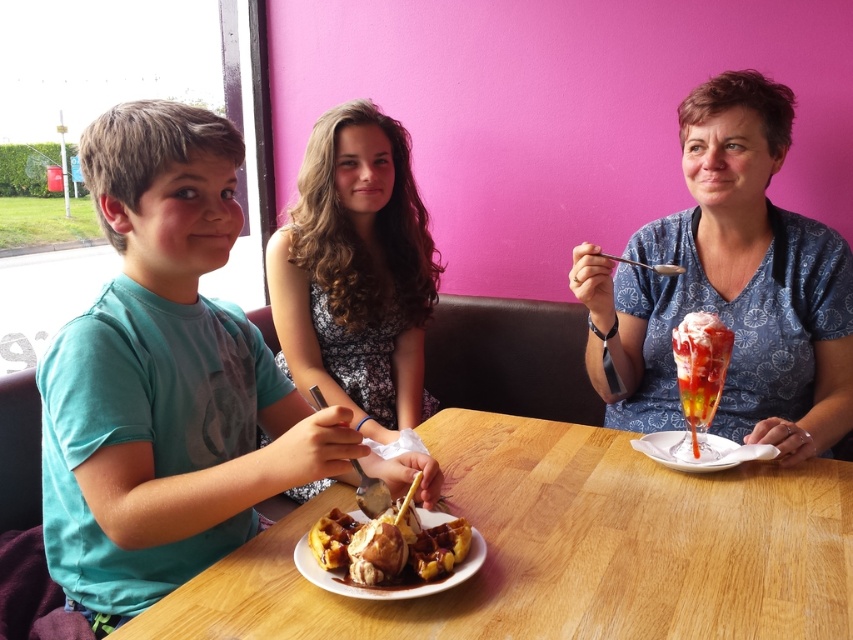
You are a photographer taking a picture of the dining scene. You notice two points in the image at coordinates point (140, 465) and point (677, 438). Which point should you focus on to ensure it appears clearer in the photo?

Point (140, 465) should be focused on because it is closer to the camera and will appear clearer in the photo compared to point (677, 438) which is farther away.

You are a waiter in the cafe. You need to place a new drink order for the customer wearing the teal matte shirt at left. Where should you place the drink relative to the white glossy plate at lower right?

The teal matte shirt at left is positioned over the white glossy plate at lower right, so you should place the drink to the right side of the white glossy plate at lower right to avoid blocking the customer.